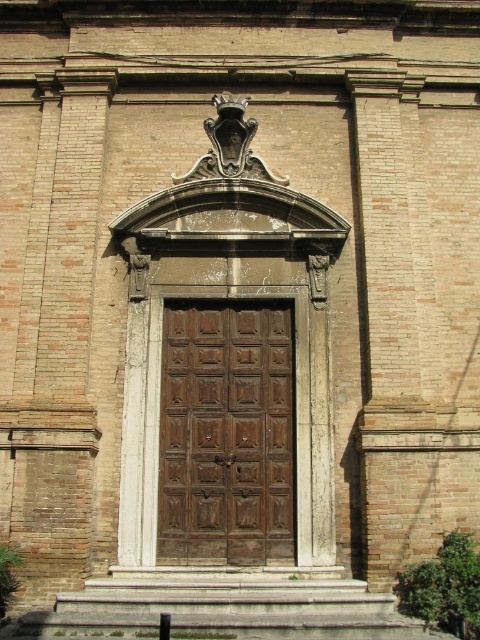
Question: Does dark brown wood door at center appear over smooth stone steps at center?

Choices:
 (A) yes
 (B) no

Answer: (A)

Question: Which of the following is the closest to the observer?

Choices:
 (A) (240, 392)
 (B) (124, 636)

Answer: (B)

Question: Which object is closer to the camera taking this photo?

Choices:
 (A) smooth stone steps at center
 (B) dark brown wood door at center

Answer: (A)

Question: Is dark brown wood door at center thinner than smooth stone steps at center?

Choices:
 (A) no
 (B) yes

Answer: (B)

Question: Is dark brown wood door at center behind smooth stone steps at center?

Choices:
 (A) yes
 (B) no

Answer: (A)